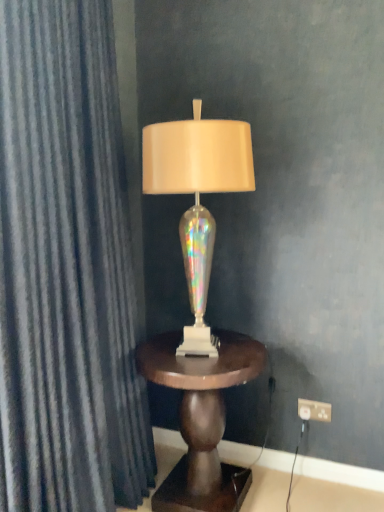
Question: Is iridescent glass lamp at center surrounding mahogany wood side table at center?

Choices:
 (A) yes
 (B) no

Answer: (B)

Question: Is iridescent glass lamp at center closer to camera compared to mahogany wood side table at center?

Choices:
 (A) no
 (B) yes

Answer: (B)

Question: Is iridescent glass lamp at center wider than mahogany wood side table at center?

Choices:
 (A) yes
 (B) no

Answer: (B)

Question: Does iridescent glass lamp at center lie behind mahogany wood side table at center?

Choices:
 (A) no
 (B) yes

Answer: (A)

Question: Considering the relative sizes of iridescent glass lamp at center and mahogany wood side table at center in the image provided, is iridescent glass lamp at center bigger than mahogany wood side table at center?

Choices:
 (A) no
 (B) yes

Answer: (A)

Question: From the image's perspective, is iridescent glass lamp at center located above mahogany wood side table at center?

Choices:
 (A) yes
 (B) no

Answer: (A)

Question: Can you confirm if mahogany wood side table at center is shorter than white plastic outlet at lower right?

Choices:
 (A) no
 (B) yes

Answer: (A)

Question: Is mahogany wood side table at center further to the viewer compared to white plastic outlet at lower right?

Choices:
 (A) no
 (B) yes

Answer: (A)

Question: Does mahogany wood side table at center have a larger size compared to white plastic outlet at lower right?

Choices:
 (A) no
 (B) yes

Answer: (B)

Question: From the image's perspective, is mahogany wood side table at center on white plastic outlet at lower right?

Choices:
 (A) no
 (B) yes

Answer: (A)

Question: Is mahogany wood side table at center far away from white plastic outlet at lower right?

Choices:
 (A) yes
 (B) no

Answer: (B)

Question: Could white plastic outlet at lower right be considered to be inside mahogany wood side table at center?

Choices:
 (A) no
 (B) yes

Answer: (A)

Question: Is mahogany wood side table at center to the left of iridescent glass lamp at center from the viewer's perspective?

Choices:
 (A) no
 (B) yes

Answer: (A)